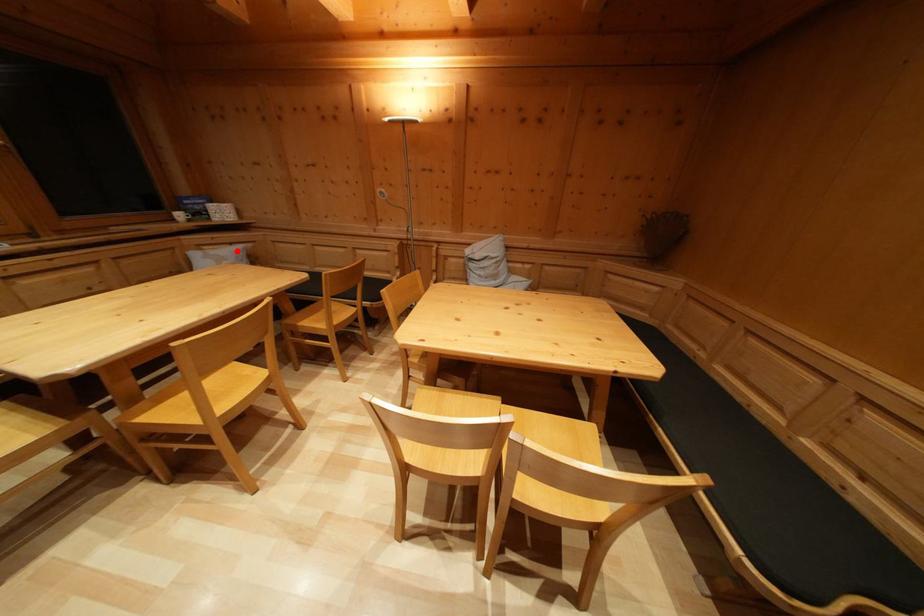
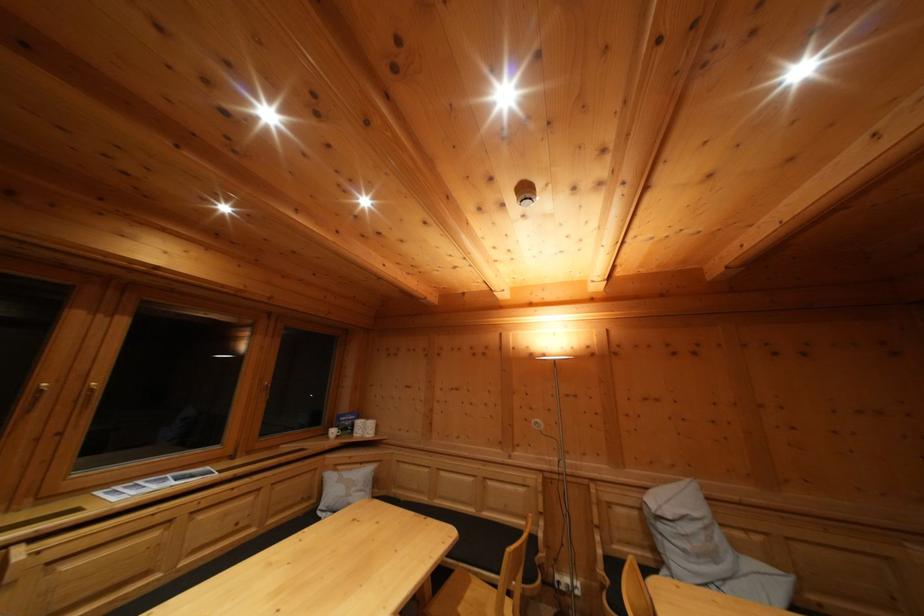
Question: I am providing you with two images of the same scene from different viewpoints. Image1 has a red point marked. In image2, the corresponding 3D location appears at what relative position? Reply with the corresponding letter.

Choices:
 (A) Closer
 (B) Farther

Answer: (B)